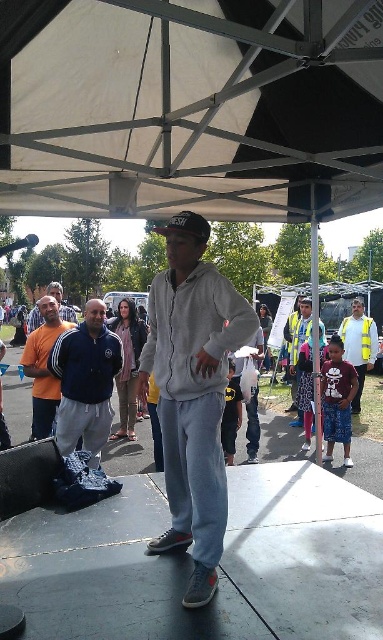
Does point (37, 372) come farther from viewer compared to point (73, 317)?

No, it is not.

Can you confirm if orange cotton t-shirt at left is bigger than matte black hoodie at center?

No, orange cotton t-shirt at left is not bigger than matte black hoodie at center.

Between point (55, 387) and point (60, 305), which one is positioned in front?

Point (55, 387) is in front.

Locate an element on the screen. Image resolution: width=383 pixels, height=640 pixels. orange cotton t-shirt at left is located at coordinates (44, 365).

Can you confirm if blue fleece jacket at center is positioned above orange cotton t-shirt at left?

Actually, blue fleece jacket at center is below orange cotton t-shirt at left.

Which of these two, blue fleece jacket at center or orange cotton t-shirt at left, stands shorter?

blue fleece jacket at center is shorter.

Image resolution: width=383 pixels, height=640 pixels. What are the coordinates of `blue fleece jacket at center` in the screenshot? It's located at (86, 381).

Locate an element on the screen. Image resolution: width=383 pixels, height=640 pixels. blue fleece jacket at center is located at coordinates (86, 381).

Which is above, light gray fleece hoodie at center or reflective yellow vest at right?

light gray fleece hoodie at center is higher up.

Does point (181, 534) come farther from viewer compared to point (356, 362)?

No, (181, 534) is closer to viewer.

Looking at this image, who is more forward, (206,244) or (358,346)?

Positioned in front is point (206,244).

You are a GUI agent. You are given a task and a screenshot of the screen. Output one action in this format:
    pyautogui.click(x=<x>, y=<y>)
    Task: Click on the light gray fleece hoodie at center
    Image resolution: width=383 pixels, height=640 pixels.
    Given the screenshot: What is the action you would take?
    pyautogui.click(x=193, y=392)